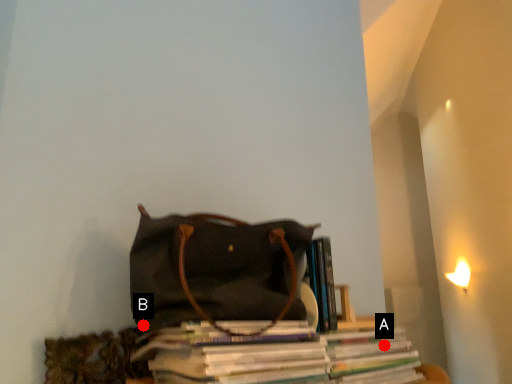
Question: Two points are circled on the image, labeled by A and B beside each circle. Which point is farther to the camera?

Choices:
 (A) A is further
 (B) B is further

Answer: (A)